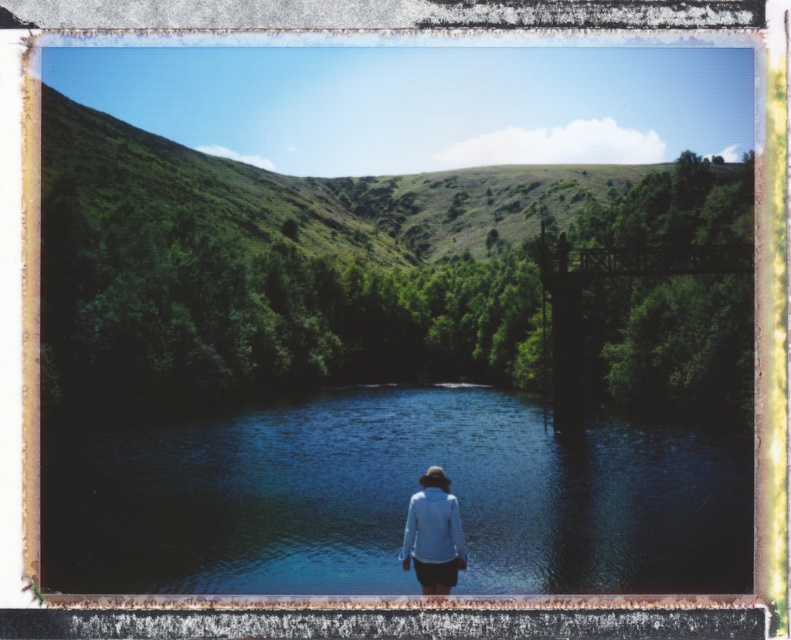
Does green grassy hillside at upper center lie in front of blue reflective water at center?

No, green grassy hillside at upper center is further to the viewer.

Based on the photo, does green grassy hillside at upper center have a smaller size compared to blue reflective water at center?

Incorrect, green grassy hillside at upper center is not smaller in size than blue reflective water at center.

Which is in front, point (335, 371) or point (267, 497)?

Point (267, 497)

Where is `green grassy hillside at upper center`? The image size is (791, 640). green grassy hillside at upper center is located at coordinates (316, 262).